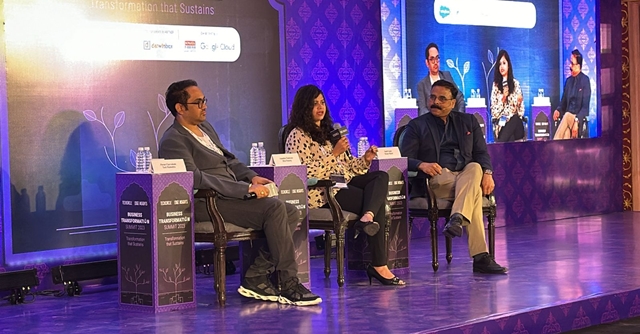
Find the location of a particular element. Image resolution: width=640 pixels, height=334 pixels. wall is located at coordinates (332, 59).